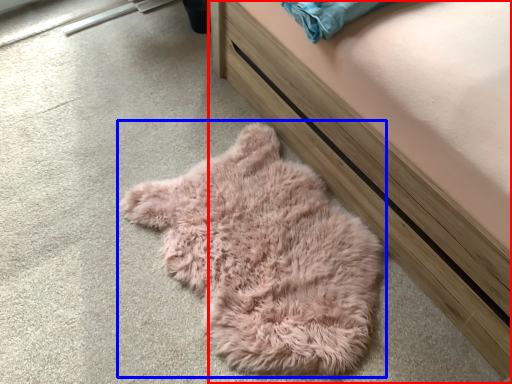
Question: Which of the following is the farthest to the observer, furniture (highlighted by a red box) or sleeping bag (highlighted by a blue box)?

Choices:
 (A) furniture
 (B) sleeping bag

Answer: (B)